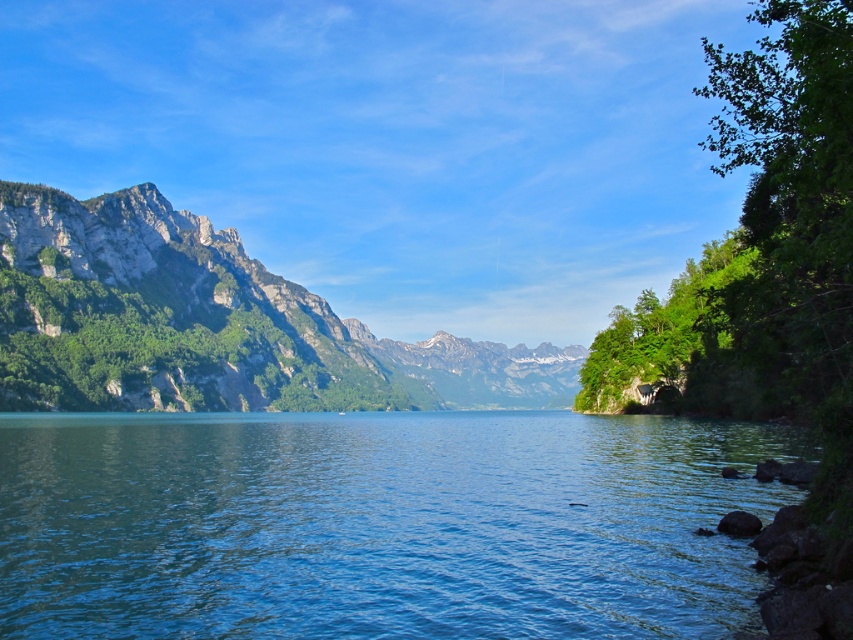
Question: Can you confirm if green water at center is positioned below rugged stone mountain at left?

Choices:
 (A) yes
 (B) no

Answer: (A)

Question: Which point is farther to the camera?

Choices:
 (A) green water at center
 (B) rugged stone mountain at left

Answer: (B)

Question: Can you confirm if green water at center is positioned to the right of rugged stone mountain at left?

Choices:
 (A) yes
 (B) no

Answer: (A)

Question: Can you confirm if green water at center is positioned to the left of rugged stone mountain at left?

Choices:
 (A) yes
 (B) no

Answer: (B)